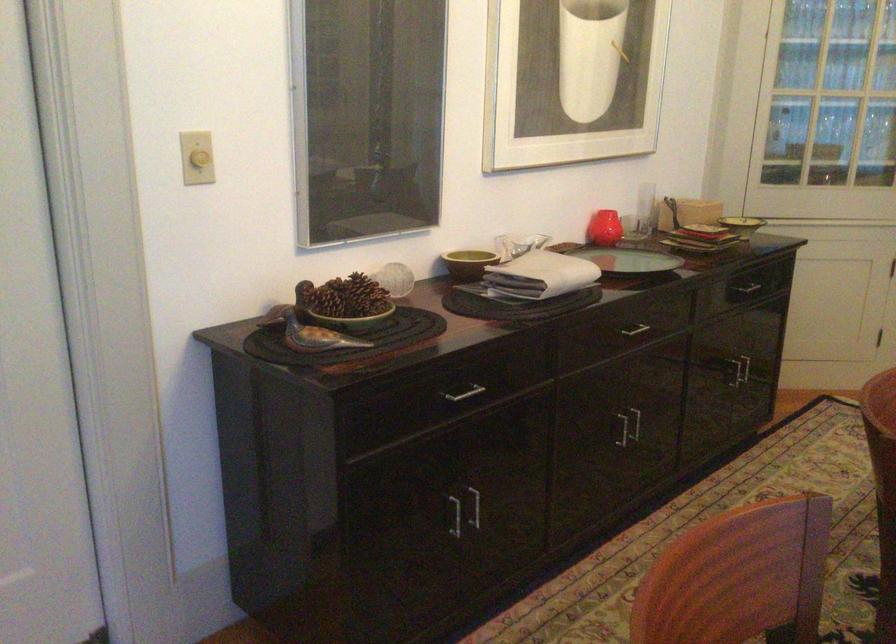
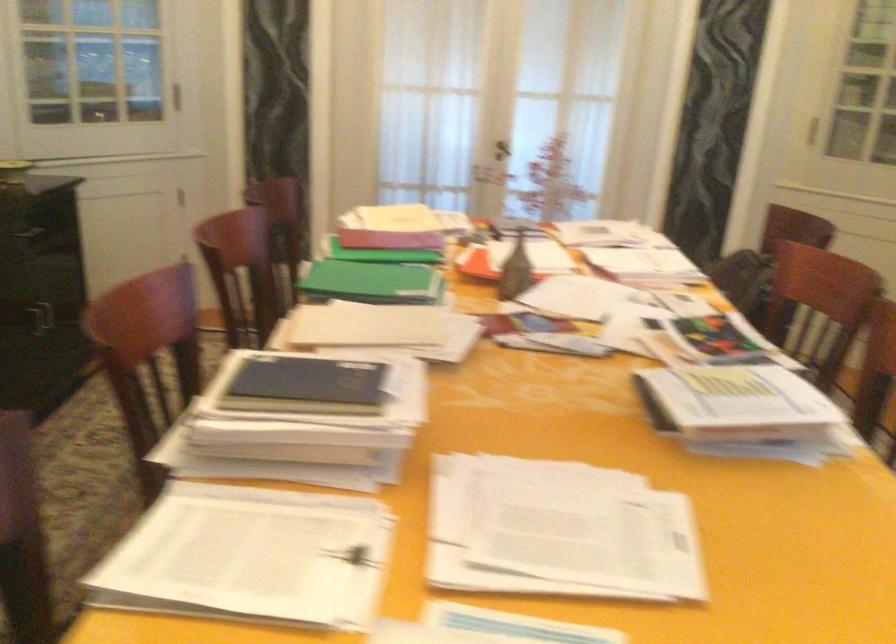
Question: The camera is either moving clockwise (left) or counter-clockwise (right) around the object. The first image is from the beginning of the video and the second image is from the end. Is the camera moving left or right when shooting the video?

Choices:
 (A) Left
 (B) Right

Answer: (A)